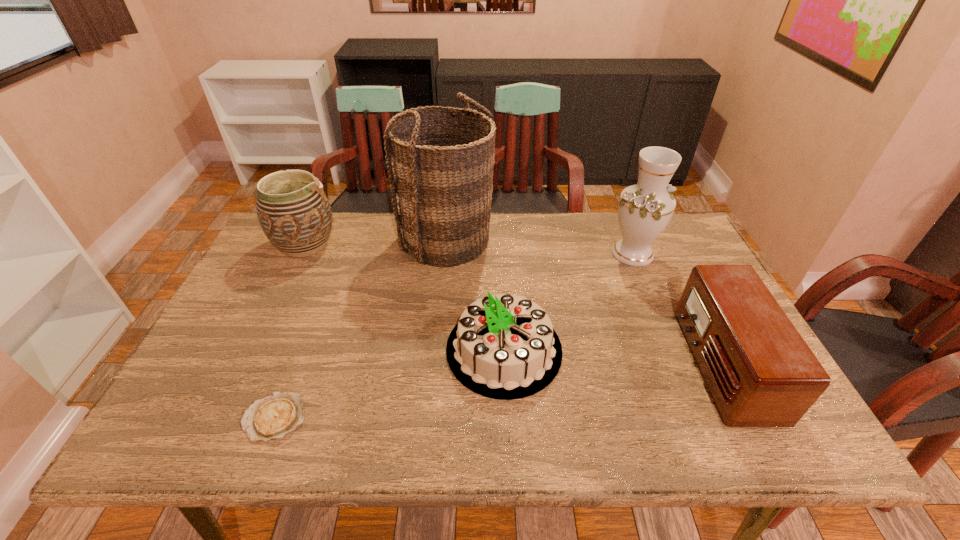
The width and height of the screenshot is (960, 540). I want to click on free location at the near right corner, so click(x=733, y=431).

The height and width of the screenshot is (540, 960). Identify the location of free point between the fourth shortest object and the birthday cake. (405, 297).

Where is `vacant region between the birthday cake and the radio receiver`? This screenshot has height=540, width=960. vacant region between the birthday cake and the radio receiver is located at coordinates (612, 357).

I want to click on unoccupied area between the birthday cake and the shortest object, so click(390, 383).

In order to click on vacant space in between the birthday cake and the vase in this screenshot , I will do `click(568, 301)`.

You are a GUI agent. You are given a task and a screenshot of the screen. Output one action in this format:
    pyautogui.click(x=<x>, y=<y>)
    Task: Click on the free spot between the radio receiver and the birthday cake
    
    Given the screenshot: What is the action you would take?
    pyautogui.click(x=612, y=357)

The image size is (960, 540). What are the coordinates of `vacant point located between the tallest object and the birthday cake` in the screenshot? It's located at point(476,295).

Where is `vacant space that is in between the basket and the birthday cake`? vacant space that is in between the basket and the birthday cake is located at coordinates (476, 295).

I want to click on free spot between the vase and the birthday cake, so click(x=568, y=301).

Identify which object is the closest to the second tallest object. Please provide its 2D coordinates. Your answer should be formatted as a tuple, i.e. [(x, y)], where the tuple contains the x and y coordinates of a point satisfying the conditions above.

[(761, 373)]